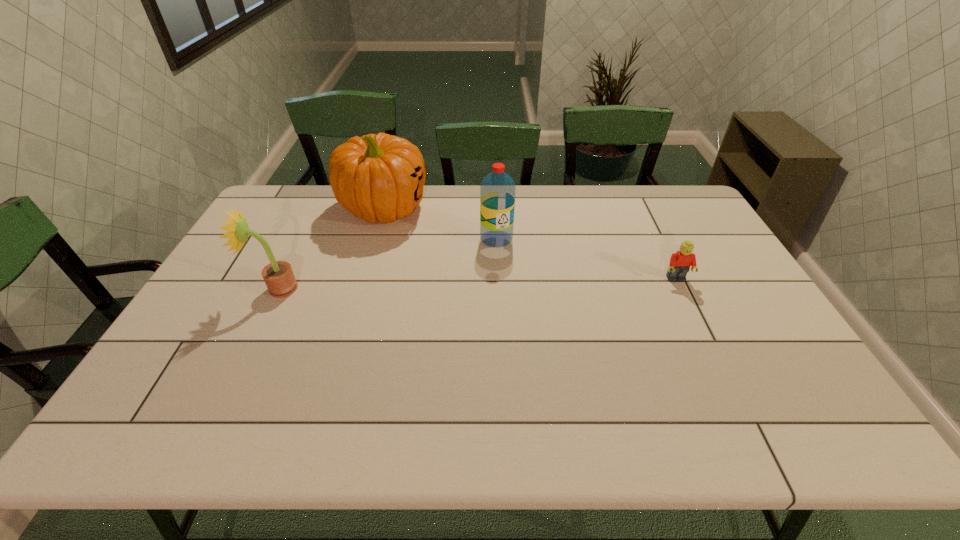
Where is `vacant space on the desktop that is between the leftmost object and the shortest object and is positioned on the front label of the water bottle`? This screenshot has width=960, height=540. vacant space on the desktop that is between the leftmost object and the shortest object and is positioned on the front label of the water bottle is located at coordinates (509, 283).

You are a GUI agent. You are given a task and a screenshot of the screen. Output one action in this format:
    pyautogui.click(x=<x>, y=<y>)
    Task: Click on the vacant spot on the desktop that is between the sunflower and the shortest object and is positioned on the surface of the pumpkin
    
    Given the screenshot: What is the action you would take?
    pyautogui.click(x=420, y=285)